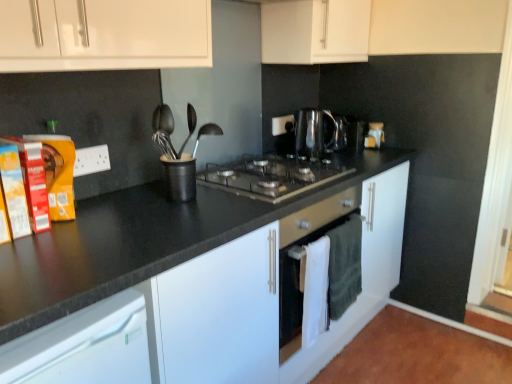
What do you see at coordinates (271, 176) in the screenshot?
I see `black glass gas stove at center` at bounding box center [271, 176].

Locate an element on the screen. The width and height of the screenshot is (512, 384). white matte cabinet at upper center is located at coordinates [x=315, y=31].

Does shiny metallic kettle at center have a smaller size compared to black granite countertop at center?

Correct, shiny metallic kettle at center occupies less space than black granite countertop at center.

From the image's perspective, is shiny metallic kettle at center located above or below black granite countertop at center?

shiny metallic kettle at center is situated higher than black granite countertop at center in the image.

Is black granite countertop at center completely or partially inside shiny metallic kettle at center?

That's incorrect, black granite countertop at center is not inside shiny metallic kettle at center.

Which object is closer to the camera taking this photo, shiny metallic kettle at center or black granite countertop at center?

black granite countertop at center is more forward.

Is shiny metallic kettle at center aimed at black glass gas stove at center?

No, shiny metallic kettle at center is not turned towards black glass gas stove at center.

Is shiny metallic kettle at center placed right next to black glass gas stove at center?

shiny metallic kettle at center and black glass gas stove at center are not in contact.

How different are the orientations of shiny metallic kettle at center and black glass gas stove at center in degrees?

1.12 degrees separate the facing orientations of shiny metallic kettle at center and black glass gas stove at center.

Is black granite countertop at center oriented towards black glass gas stove at center?

No, black granite countertop at center is not oriented towards black glass gas stove at center.

Is black granite countertop at center taller than black glass gas stove at center?

Indeed, black granite countertop at center has a greater height compared to black glass gas stove at center.

Can you confirm if black granite countertop at center is smaller than black glass gas stove at center?

No, black granite countertop at center is not smaller than black glass gas stove at center.

Could you tell me if black glass gas stove at center is turned towards black matte utensil holder at center?

No, black glass gas stove at center is not aimed at black matte utensil holder at center.

From a real-world perspective, which object rests below the other?

black glass gas stove at center is physically lower.

Between black glass gas stove at center and black matte utensil holder at center, which one is positioned in front?

Positioned in front is black matte utensil holder at center.

Which is behind, shiny metallic kettle at center or black matte utensil holder at center?

shiny metallic kettle at center.

From the image's perspective, relative to black matte utensil holder at center, is shiny metallic kettle at center above or below?

Clearly, from the image's perspective, shiny metallic kettle at center is above black matte utensil holder at center.

Is shiny metallic kettle at center at the left side of black matte utensil holder at center?

In fact, shiny metallic kettle at center is to the right of black matte utensil holder at center.

How much distance is there between shiny metallic kettle at center and black matte utensil holder at center?

shiny metallic kettle at center is 30.77 inches from black matte utensil holder at center.

Measure the distance from black glass gas stove at center to white matte cabinet at upper center.

black glass gas stove at center and white matte cabinet at upper center are 24.92 inches apart from each other.

Is black glass gas stove at center beside white matte cabinet at upper center?

black glass gas stove at center and white matte cabinet at upper center are clearly separated.

From a real-world perspective, is black glass gas stove at center beneath white matte cabinet at upper center?

Yes, from a real-world perspective, black glass gas stove at center is below white matte cabinet at upper center.

Considering the relative positions of black glass gas stove at center and white matte cabinet at upper center in the image provided, is black glass gas stove at center to the left or to the right of white matte cabinet at upper center?

In the image, black glass gas stove at center appears on the left side of white matte cabinet at upper center.

Considering the positions of point (310, 171) and point (316, 145), is point (310, 171) closer or farther from the camera than point (316, 145)?

Point (310, 171) is closer to the camera than point (316, 145).

Considering their positions, is black glass gas stove at center located in front of or behind shiny metallic kettle at center?

Clearly, black glass gas stove at center is in front of shiny metallic kettle at center.

Identify the location of gas stove on the left of shiny metallic kettle at center. (271, 176).

Can you confirm if black glass gas stove at center is shorter than shiny metallic kettle at center?

Yes, black glass gas stove at center is shorter than shiny metallic kettle at center.

Where is `counter top located in front of the shiny metallic kettle at center`? The image size is (512, 384). counter top located in front of the shiny metallic kettle at center is located at coordinates (140, 241).

Where is `gas stove on the left of shiny metallic kettle at center`? gas stove on the left of shiny metallic kettle at center is located at coordinates (271, 176).

Looking at the image, which one is located further to black granite countertop at center, white matte cabinet at upper center or black glass gas stove at center?

The object further to black granite countertop at center is white matte cabinet at upper center.

Which object lies nearer to the anchor point black matte utensil holder at center, shiny metallic kettle at center or white matte cabinet at upper center?

shiny metallic kettle at center.

Looking at the image, which one is located further to black matte utensil holder at center, shiny metallic kettle at center or black glass gas stove at center?

Based on the image, shiny metallic kettle at center appears to be further to black matte utensil holder at center.

Based on their spatial positions, is black glass gas stove at center or shiny metallic kettle at center further from black matte utensil holder at center?

shiny metallic kettle at center.

Based on their spatial positions, is black glass gas stove at center or black matte utensil holder at center closer to shiny metallic kettle at center?

black glass gas stove at center.

Looking at the image, which one is located closer to black matte utensil holder at center, white matte cabinet at upper center or black granite countertop at center?

black granite countertop at center is closer to black matte utensil holder at center.

Consider the image. When comparing their distances from black matte utensil holder at center, does white matte cabinet at upper center or black glass gas stove at center seem further?

The object further to black matte utensil holder at center is white matte cabinet at upper center.

Estimate the real-world distances between objects in this image. Which object is closer to white matte cabinet at upper center, black granite countertop at center or black matte utensil holder at center?

black granite countertop at center lies closer to white matte cabinet at upper center than the other object.

Where is `appliance between black granite countertop at center and shiny metallic kettle at center from front to back`? appliance between black granite countertop at center and shiny metallic kettle at center from front to back is located at coordinates [x=180, y=177].

This screenshot has width=512, height=384. What are the coordinates of `gas stove between white matte cabinet at upper center and black granite countertop at center in the vertical direction` in the screenshot? It's located at (271, 176).

This screenshot has width=512, height=384. Find the location of `kitchen appliance that lies between white matte cabinet at upper center and black granite countertop at center from top to bottom`. kitchen appliance that lies between white matte cabinet at upper center and black granite countertop at center from top to bottom is located at coordinates (313, 132).

The image size is (512, 384). Find the location of `kitchen appliance that lies between white matte cabinet at upper center and black matte utensil holder at center from top to bottom`. kitchen appliance that lies between white matte cabinet at upper center and black matte utensil holder at center from top to bottom is located at coordinates (313, 132).